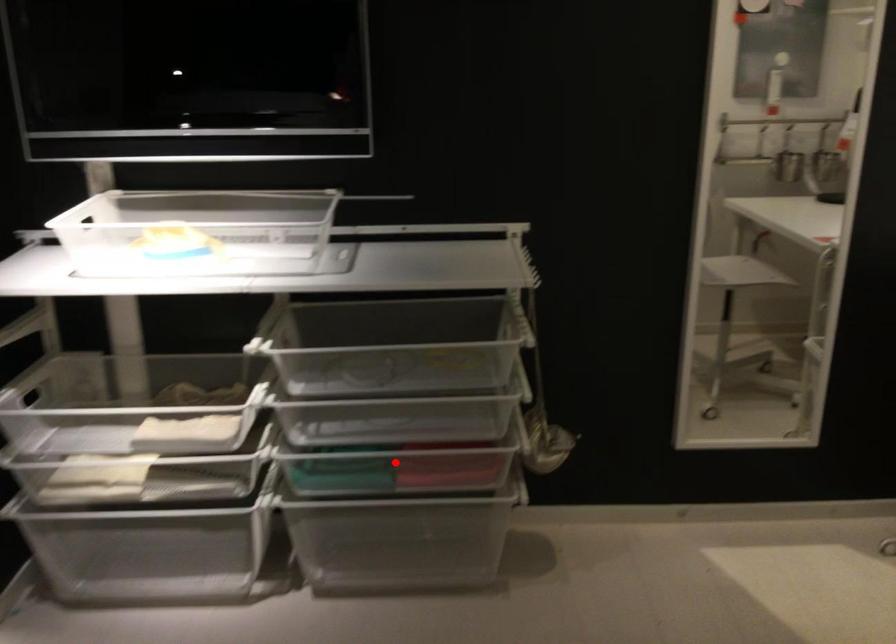
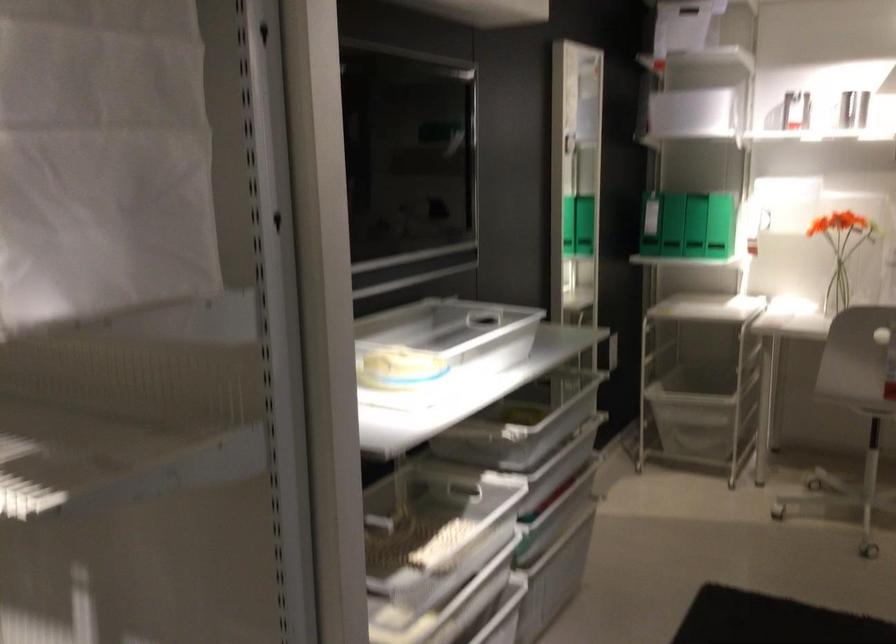
Question: I am providing you with two images of the same scene from different viewpoints. A red point is marked on the first image. At the location where the point appears in image 1, is it still visible in image 2?

Choices:
 (A) Yes
 (B) No

Answer: (B)